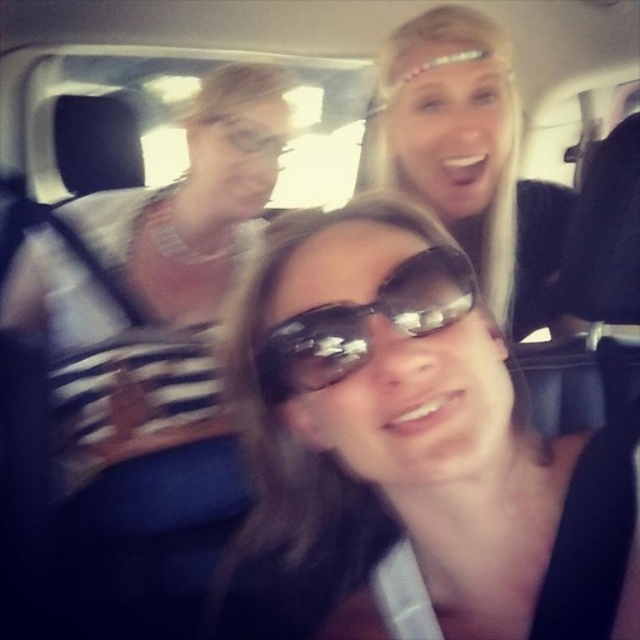
You are a fashion designer observing the image. You need to determine which object occupies more horizontal space in the scene between the matte black dress at upper left and the blonde hair at upper center. Based on the description, which one is wider?

The matte black dress at upper left is wider than the blonde hair at upper center.

Based on the coordinates provided in the scene description, where is the sunglasses at center positioned?

The sunglasses at center is positioned at coordinates point (406, 448).

You are taking a photo of two points in a car scene. The first point is at coordinates point (465,442) and the second is at point (429,19). Based on the scene description, which point is nearer to the camera?

Point (465,442) is closer to the camera than point (429,19).